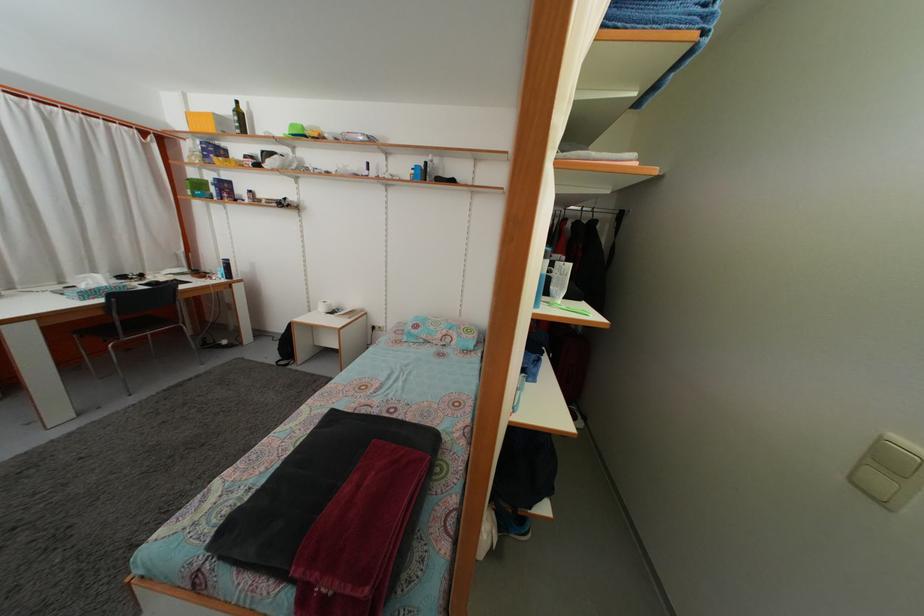
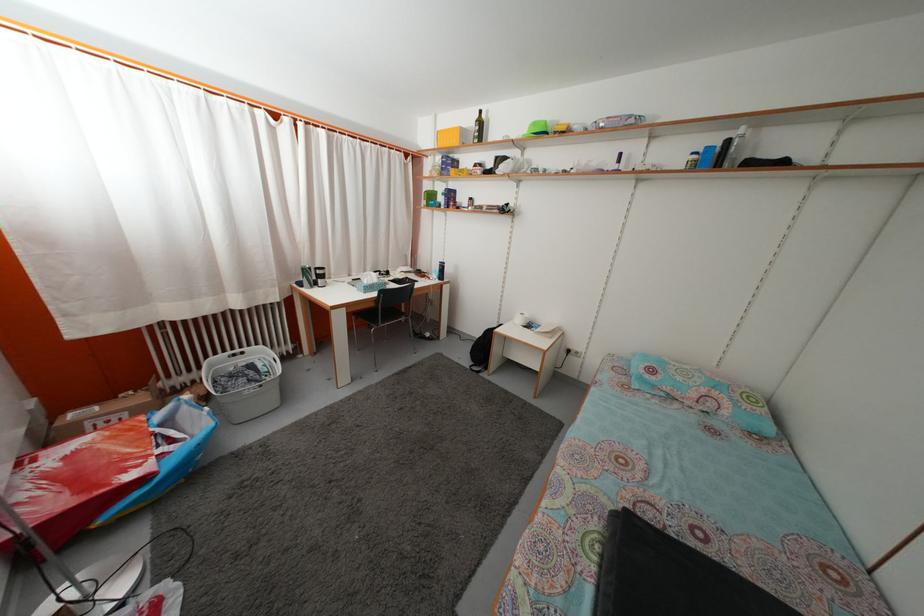
Question: Based on the continuous images, in which direction is the camera rotating? Reply with the corresponding letter.

Choices:
 (A) Left
 (B) Right
 (C) Up
 (D) Down

Answer: (A)